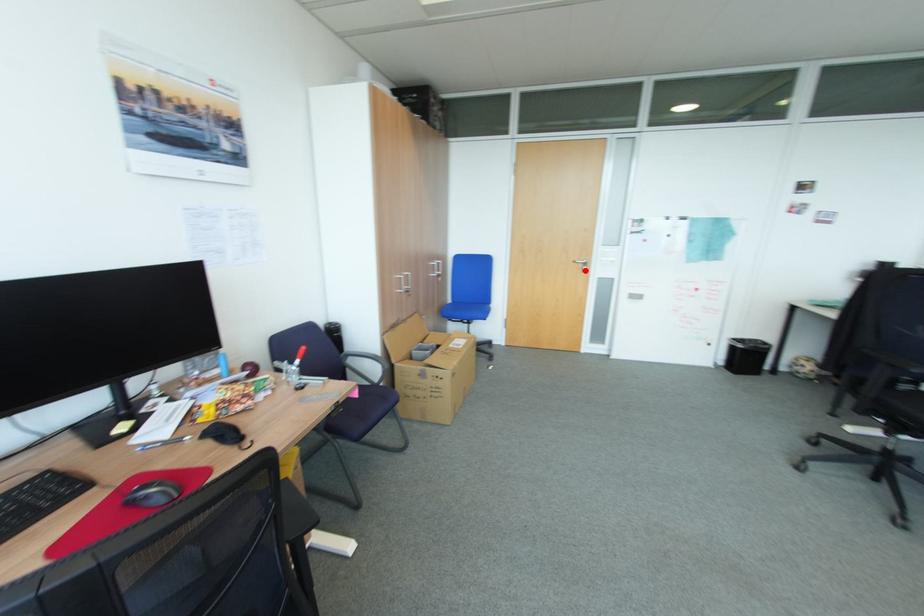
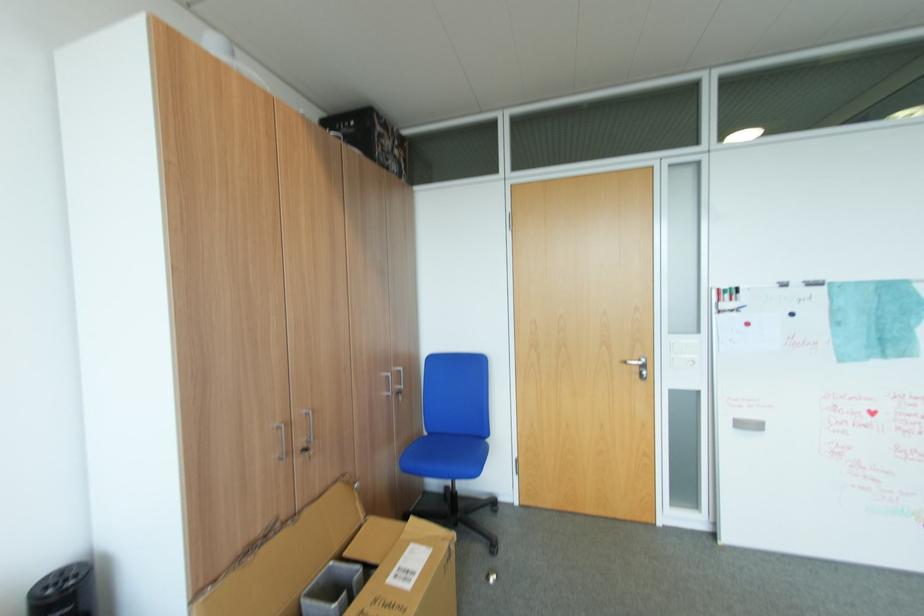
Where in the second image is the point corresponding to the highlighted location from the first image?

(642, 377)